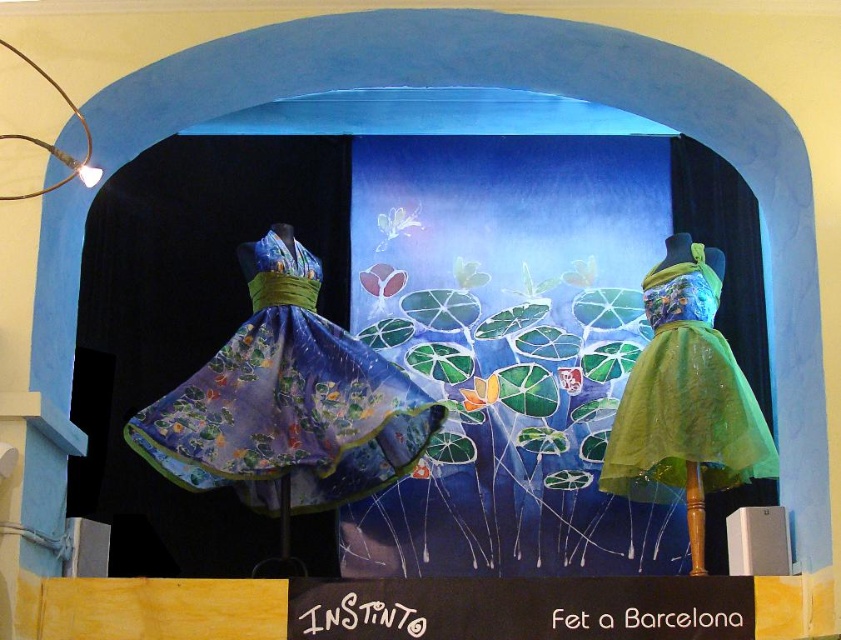
Between shiny blue fabric dress at left and green tulle dress at right, which one has less height?

green tulle dress at right

Between point (318, 433) and point (646, 406), which one is positioned behind?

Positioned behind is point (646, 406).

Does point (152, 406) lie behind point (652, 326)?

No, it is not.

This screenshot has height=640, width=841. I want to click on shiny blue fabric dress at left, so click(x=287, y=401).